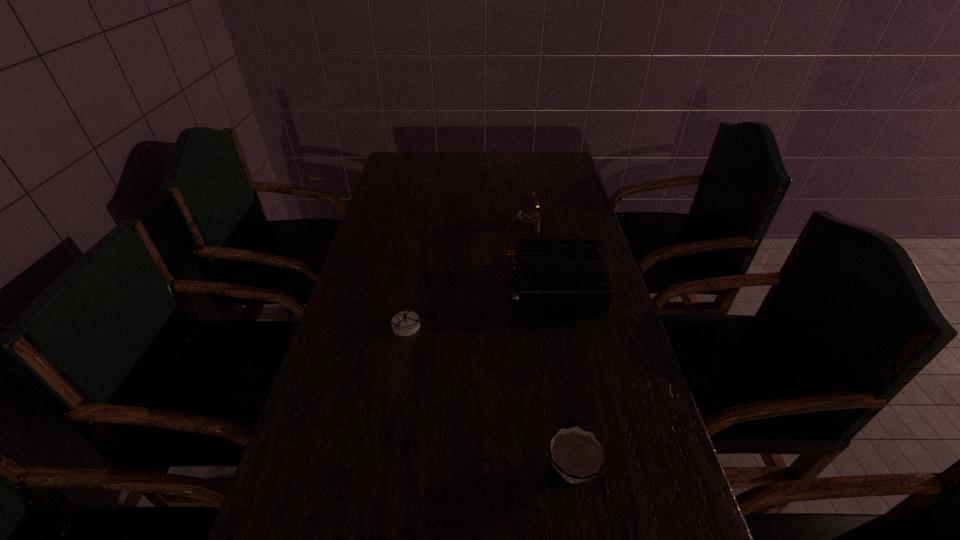
Identify the location of vacant space located 0.170m on the back panel of the router. (447, 286).

In order to click on vacant point located on the back panel of the router in this screenshot , I will do `click(415, 286)`.

I want to click on free region located 0.400m on the side of the cup with the handle, so click(544, 298).

Where is `vacant region located on the side of the cup with the handle`? The height and width of the screenshot is (540, 960). vacant region located on the side of the cup with the handle is located at coordinates (553, 357).

Where is `blank space located on the side of the cup with the handle`? Image resolution: width=960 pixels, height=540 pixels. blank space located on the side of the cup with the handle is located at coordinates (550, 338).

What are the coordinates of `vacant area situated 0.310m on the right of the nearer compass` in the screenshot? It's located at (545, 326).

Identify the location of object situated at the left edge. This screenshot has height=540, width=960. (405, 323).

Image resolution: width=960 pixels, height=540 pixels. In order to click on compass located in the right edge section of the desktop in this screenshot , I will do tap(528, 218).

What are the coordinates of `router situated at the right edge` in the screenshot? It's located at (552, 276).

Locate an element on the screen. The height and width of the screenshot is (540, 960). cup positioned at the right edge is located at coordinates (578, 456).